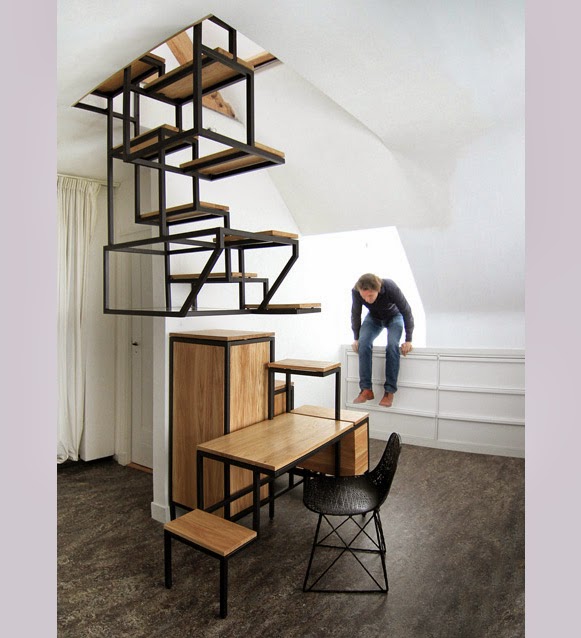
Where is `chair`? chair is located at coordinates (347, 489).